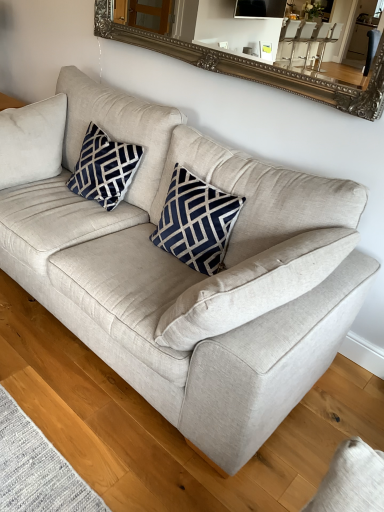
Question: Is silver ornate mirror at upper center to the left or to the right of navy blue textured pillow at center in the image?

Choices:
 (A) left
 (B) right

Answer: (B)

Question: From the image's perspective, relative to navy blue textured pillow at center, is silver ornate mirror at upper center above or below?

Choices:
 (A) below
 (B) above

Answer: (B)

Question: Based on their relative distances, which object is nearer to the silver ornate mirror at upper center?

Choices:
 (A) navy velvet pillow at upper left
 (B) navy blue textured pillow at center

Answer: (A)

Question: Estimate the real-world distances between objects in this image. Which object is farther from the navy velvet pillow at upper left?

Choices:
 (A) navy blue textured pillow at center
 (B) silver ornate mirror at upper center

Answer: (B)